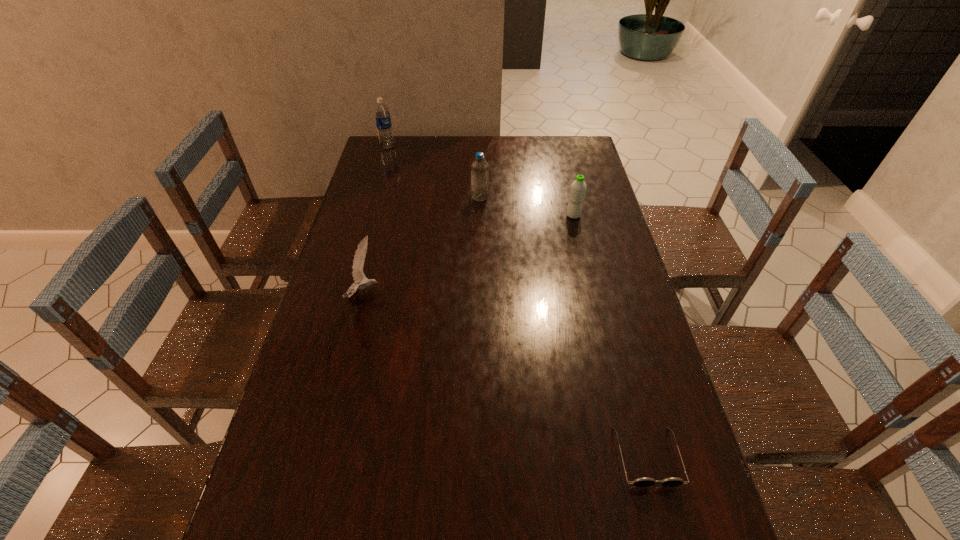
This screenshot has height=540, width=960. Find the location of `the farthest water bottle`. the farthest water bottle is located at coordinates (382, 114).

Identify the location of the tallest object. This screenshot has height=540, width=960. (382, 114).

Identify the location of the fourth nearest object. (479, 168).

Identify the location of the second water bottle from right to left. (479, 168).

This screenshot has width=960, height=540. Find the location of `the rightmost water bottle`. the rightmost water bottle is located at coordinates (578, 188).

Image resolution: width=960 pixels, height=540 pixels. What are the coordinates of `the nearest water bottle` in the screenshot? It's located at (578, 188).

The height and width of the screenshot is (540, 960). What are the coordinates of `gull` in the screenshot? It's located at (359, 258).

Locate an element on the screen. This screenshot has width=960, height=540. the second shortest object is located at coordinates (359, 258).

Image resolution: width=960 pixels, height=540 pixels. Find the location of `sunglasses`. sunglasses is located at coordinates (640, 482).

The image size is (960, 540). Find the location of `the nearest object`. the nearest object is located at coordinates (640, 482).